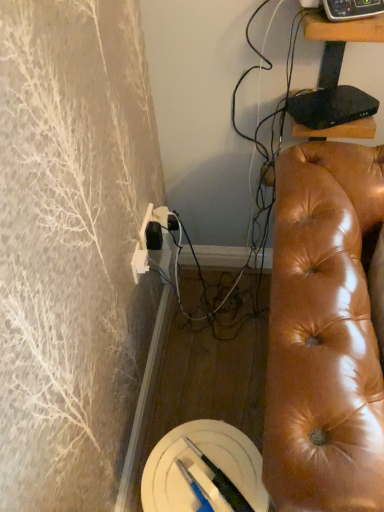
Question: In terms of size, does black glossy tv stand at upper right appear bigger or smaller than shiny brown leather couch at right?

Choices:
 (A) big
 (B) small

Answer: (B)

Question: Considering the relative positions of black glossy tv stand at upper right and shiny brown leather couch at right in the image provided, is black glossy tv stand at upper right to the left or to the right of shiny brown leather couch at right?

Choices:
 (A) right
 (B) left

Answer: (B)

Question: Which object is positioned closest to the black glossy tv stand at upper right?

Choices:
 (A) shiny brown leather couch at right
 (B) black plastic remote control at upper right

Answer: (B)

Question: Which of these objects is positioned farthest from the black glossy tv stand at upper right?

Choices:
 (A) shiny brown leather couch at right
 (B) black plastic remote control at upper right

Answer: (A)